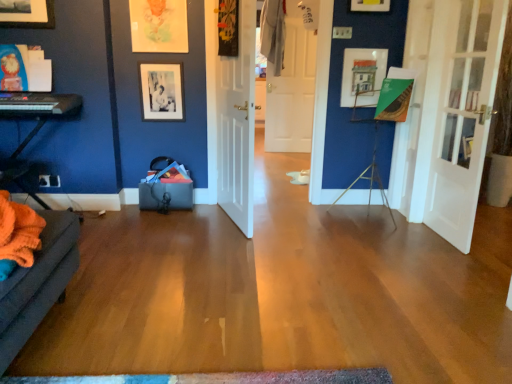
Where is `free spot to the left of multicolored woven mat at lower center`? free spot to the left of multicolored woven mat at lower center is located at coordinates (99, 349).